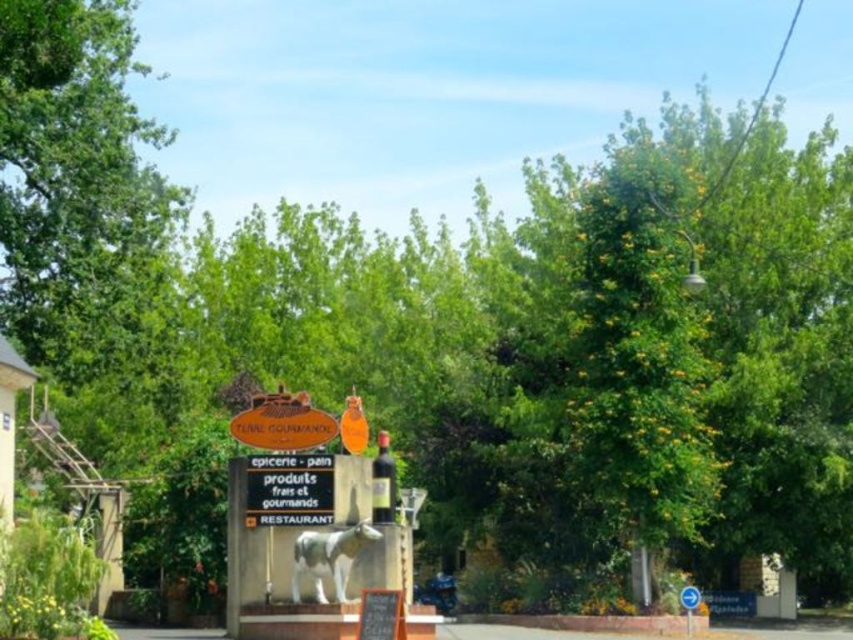
Question: Which of the following is the closest to the observer?

Choices:
 (A) (689, 620)
 (B) (241, 416)
 (C) (259, 516)

Answer: (C)

Question: Considering the relative positions of black plastic sign at center and orange wood sign at center in the image provided, where is black plastic sign at center located with respect to orange wood sign at center?

Choices:
 (A) below
 (B) above

Answer: (A)

Question: Among these objects, which one is nearest to the camera?

Choices:
 (A) orange wood sign at center
 (B) white plastic sign at lower right
 (C) black plastic sign at center

Answer: (C)

Question: Considering the relative positions of black plastic sign at center and orange wood sign at center in the image provided, where is black plastic sign at center located with respect to orange wood sign at center?

Choices:
 (A) below
 (B) above

Answer: (A)

Question: Which of the following is the farthest from the observer?

Choices:
 (A) (695, 595)
 (B) (285, 412)

Answer: (A)

Question: Can you confirm if black plastic sign at center is thinner than orange wood sign at center?

Choices:
 (A) no
 (B) yes

Answer: (B)